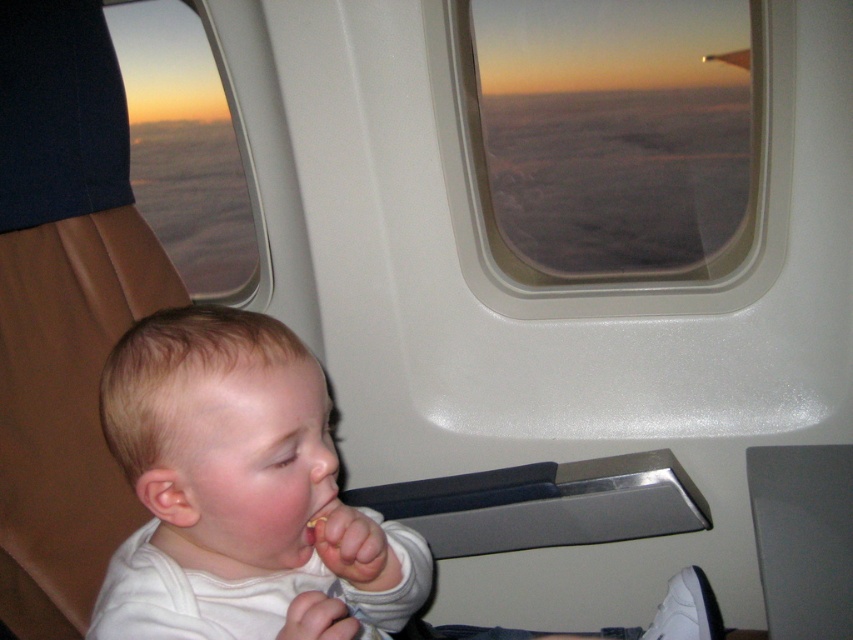
How much distance is there between white matte baby at center and smooth yellowish flesh at mouth center?

11.31 centimeters

Who is more distant from viewer, (254, 577) or (328, 540)?

Point (254, 577)

Where is `white matte baby at center`? The image size is (853, 640). white matte baby at center is located at coordinates (239, 492).

This screenshot has height=640, width=853. Find the location of `white matte baby at center`. white matte baby at center is located at coordinates (239, 492).

Is white matte baby at center further to camera compared to matte glass airplane window at upper left?

No.

Locate an element on the screen. The width and height of the screenshot is (853, 640). white matte baby at center is located at coordinates (239, 492).

Between transparent glass airplane window at upper center and smooth yellowish flesh at mouth center, which one has more height?

transparent glass airplane window at upper center is taller.

Between point (759, 166) and point (323, 545), which one is positioned behind?

Point (759, 166)

Is point (467, 168) positioned in front of point (321, 541)?

No, it is not.

Identify the location of transparent glass airplane window at upper center. (628, 282).